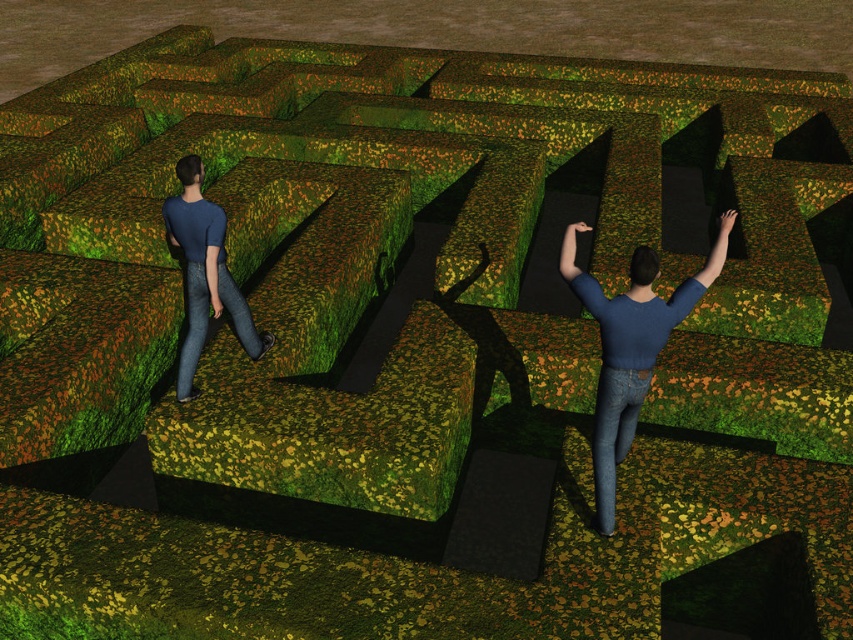
Question: Is denim at right wider than blue fabric arm at upper right?

Choices:
 (A) yes
 (B) no

Answer: (B)

Question: Estimate the real-world distances between objects in this image. Which object is farther from the blue matte shirt at left?

Choices:
 (A) matte blue arm at center
 (B) blue denim jeans at left
 (C) denim at right

Answer: (C)

Question: Which of the following is the farthest from the observer?

Choices:
 (A) blue denim jeans at center
 (B) blue fabric arm at upper right

Answer: (B)

Question: Which point is closer to the camera taking this photo?

Choices:
 (A) (231, 308)
 (B) (218, 296)

Answer: (B)

Question: Is blue denim jeans at center smaller than blue matte shirt at left?

Choices:
 (A) yes
 (B) no

Answer: (B)

Question: Where is blue denim jeans at center located in relation to blue denim jeans at left in the image?

Choices:
 (A) left
 (B) right

Answer: (B)